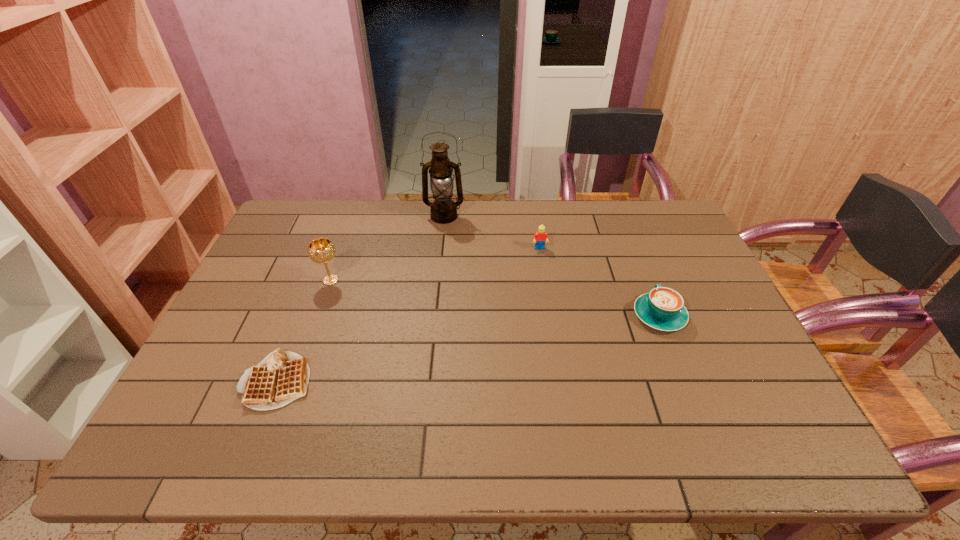
The width and height of the screenshot is (960, 540). In order to click on free point at the far edge in this screenshot , I will do `click(584, 226)`.

The height and width of the screenshot is (540, 960). I want to click on vacant space at the near edge, so click(683, 458).

Identify the location of free region at the left edge of the desktop. The width and height of the screenshot is (960, 540). (297, 271).

I want to click on vacant space at the right edge, so click(751, 368).

I want to click on vacant space at the far left corner, so click(319, 231).

The width and height of the screenshot is (960, 540). Find the location of `vacant space at the far right corner of the desktop`. vacant space at the far right corner of the desktop is located at coordinates (650, 231).

At what (x,y) coordinates should I click in order to perform the action: click on free spot at the near right corner of the desktop. Please return your answer as a coordinate pair (x, y). The width and height of the screenshot is (960, 540). Looking at the image, I should click on (788, 424).

At what (x,y) coordinates should I click in order to perform the action: click on free spot between the oil lamp and the fourth nearest object. Please return your answer as a coordinate pair (x, y). The width and height of the screenshot is (960, 540). Looking at the image, I should click on (492, 233).

Locate an element on the screen. The height and width of the screenshot is (540, 960). vacant point located between the nearest object and the second tallest object is located at coordinates (304, 330).

Find the location of a particular element. The width and height of the screenshot is (960, 540). vacant area that lies between the third farthest object and the oil lamp is located at coordinates (387, 248).